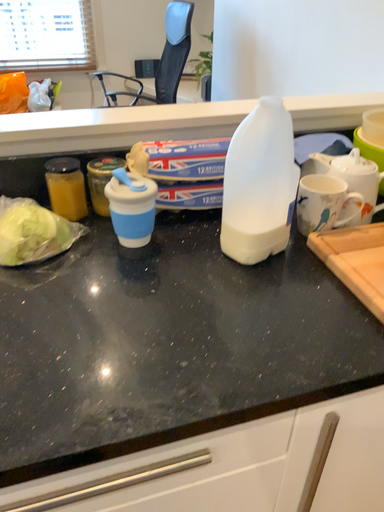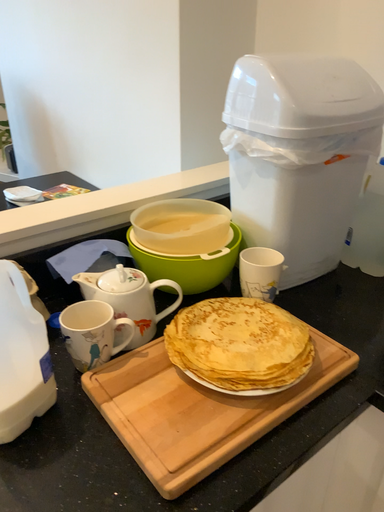
Question: How did the camera likely rotate when shooting the video?

Choices:
 (A) rotated left
 (B) rotated right

Answer: (B)